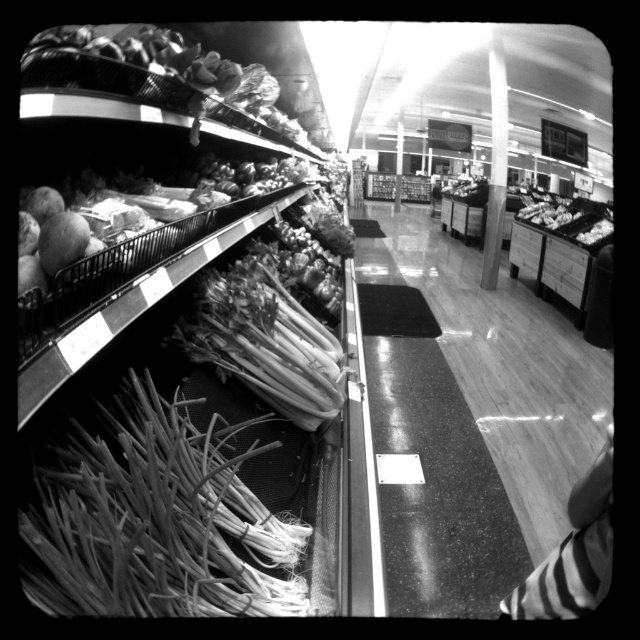
You are standing at the entrance of the grocery store and see the point marked at coordinates [474,420]. Based on the scene description, what surface is this point located on?

The point marked at coordinates [474,420] is located on the smooth glossy floor at center.

You are a delivery person who just dropped off a heavy box and need to walk from the entrance to the employee break room. The entrance is at the far end of the aisle, and the break room is behind the produce section. You notice the smooth glossy floor at center and the smooth green onions at center. Which object will you step on first as you walk towards the break room?

The smooth glossy floor at center will be stepped on first because it is closer to the entrance where the delivery person starts, and the smooth green onions at center are 4.21 feet away from the floor, meaning they are further along the path towards the break room.

You are a customer in the grocery store and you want to buy some green onions. You see two bunches of smooth green onions at lower left and smooth green onions at center. Which bunch should you choose if you want the larger one?

The smooth green onions at center are larger in size compared to the smooth green onions at lower left, so you should choose the smooth green onions at center.